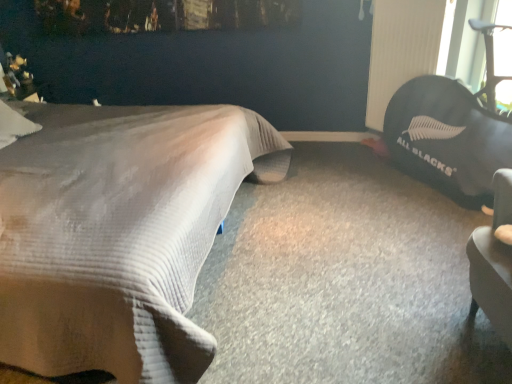
Question: Visually, is beige textured bed at left positioned to the left or to the right of black rubber radiator at upper right?

Choices:
 (A) right
 (B) left

Answer: (B)

Question: Considering the positions of beige textured bed at left and black rubber radiator at upper right in the image, is beige textured bed at left bigger or smaller than black rubber radiator at upper right?

Choices:
 (A) big
 (B) small

Answer: (A)

Question: Based on their relative distances, which object is nearer to the beige textured bed at left?

Choices:
 (A) black fabric bean bag at right
 (B) black rubber radiator at upper right

Answer: (A)

Question: Considering the real-world distances, which object is farthest from the beige textured bed at left?

Choices:
 (A) black fabric bean bag at right
 (B) black rubber radiator at upper right

Answer: (B)